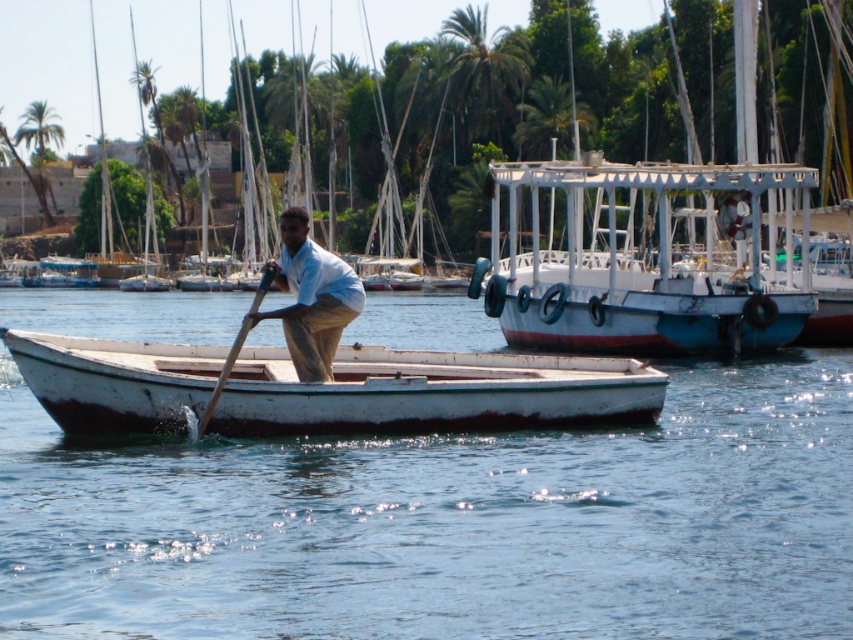
Is white wooden boat at upper right to the left of green leafy palm tree at upper center from the viewer's perspective?

No, white wooden boat at upper right is not to the left of green leafy palm tree at upper center.

Does white wooden boat at upper right appear on the right side of green leafy palm tree at upper center?

Yes, white wooden boat at upper right is to the right of green leafy palm tree at upper center.

Is point (701, 280) positioned before point (450, 65)?

Yes, it is.

You are a GUI agent. You are given a task and a screenshot of the screen. Output one action in this format:
    pyautogui.click(x=<x>, y=<y>)
    Task: Click on the white wooden boat at upper right
    
    Given the screenshot: What is the action you would take?
    pyautogui.click(x=653, y=246)

Between white matte canoe at center and light beige cotton shirt at center, which one has less height?

white matte canoe at center

Looking at this image, does white matte canoe at center have a lesser width compared to light beige cotton shirt at center?

In fact, white matte canoe at center might be wider than light beige cotton shirt at center.

The image size is (853, 640). I want to click on white matte canoe at center, so (433, 392).

Image resolution: width=853 pixels, height=640 pixels. Find the location of `white matte canoe at center`. white matte canoe at center is located at coordinates (433, 392).

Is point (605, 372) farther from camera compared to point (18, 132)?

No, it is not.

Measure the distance between point (640, 378) and camera.

Point (640, 378) and camera are 72.23 feet apart.

Locate an element on the screen. Image resolution: width=853 pixels, height=640 pixels. white matte canoe at center is located at coordinates (433, 392).